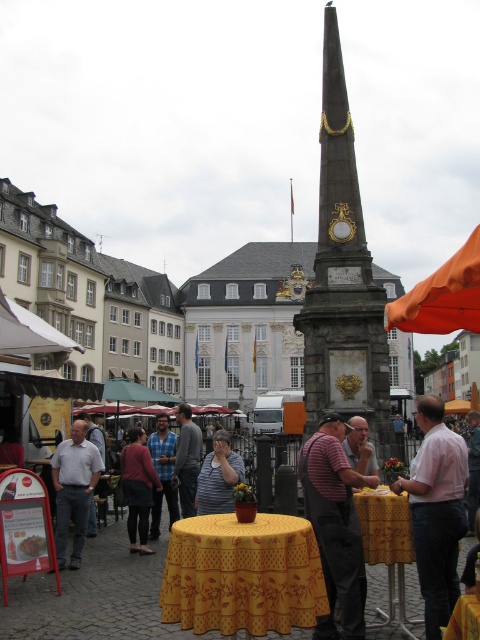
Does blue striped shirt at center appear on the right side of matte black shirt at center?

No, blue striped shirt at center is not to the right of matte black shirt at center.

Does blue striped shirt at center have a larger size compared to matte black shirt at center?

Yes, blue striped shirt at center is bigger than matte black shirt at center.

Measure the distance between point [152,442] and camera.

52.90 meters

Identify the location of blue striped shirt at center. (163, 472).

Who is shorter, striped shirt at center or blue striped shirt at center?

striped shirt at center

Where is `striped shirt at center`? The image size is (480, 640). striped shirt at center is located at coordinates (218, 476).

Can you confirm if dark gray stone obelisk at center is positioned to the right of striped shirt at center?

Correct, you'll find dark gray stone obelisk at center to the right of striped shirt at center.

Can you confirm if dark gray stone obelisk at center is smaller than striped shirt at center?

No, dark gray stone obelisk at center is not smaller than striped shirt at center.

Which is behind, point (324, 257) or point (207, 474)?

The point (324, 257) is behind.

This screenshot has height=640, width=480. I want to click on dark gray stone obelisk at center, so click(x=343, y=276).